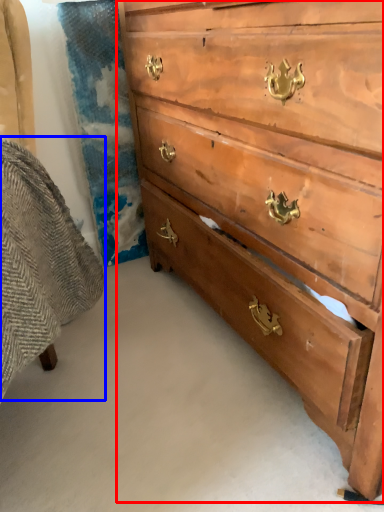
Question: Which point is further to the camera, chest of drawers (highlighted by a red box) or swivel chair (highlighted by a blue box)?

Choices:
 (A) chest of drawers
 (B) swivel chair

Answer: (A)